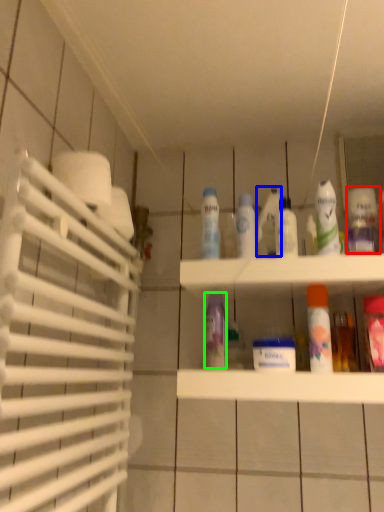
Question: Which object is positioned farthest from cleaning product (highlighted by a red box)? Select from cleaning product (highlighted by a blue box) and cleaning product (highlighted by a green box).

Choices:
 (A) cleaning product
 (B) cleaning product

Answer: (B)